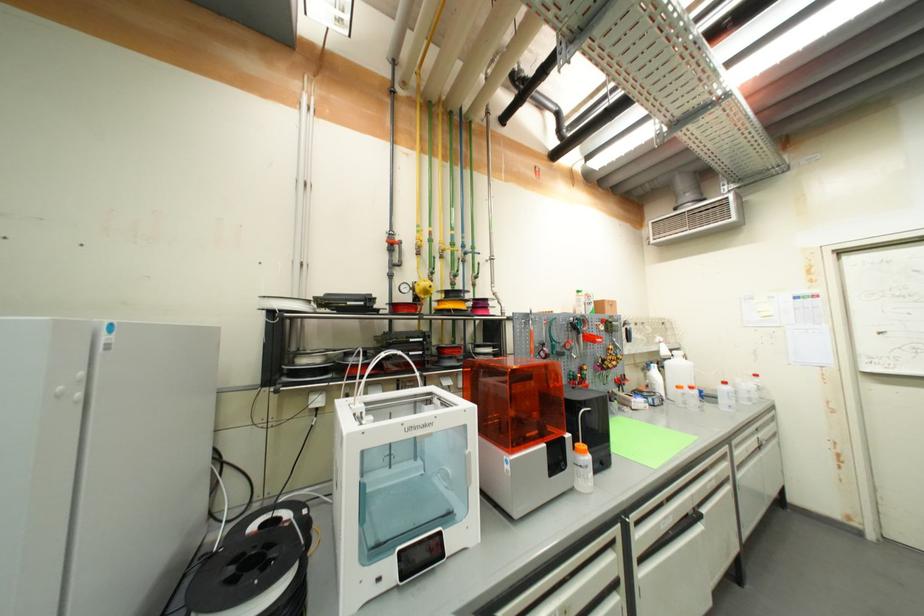
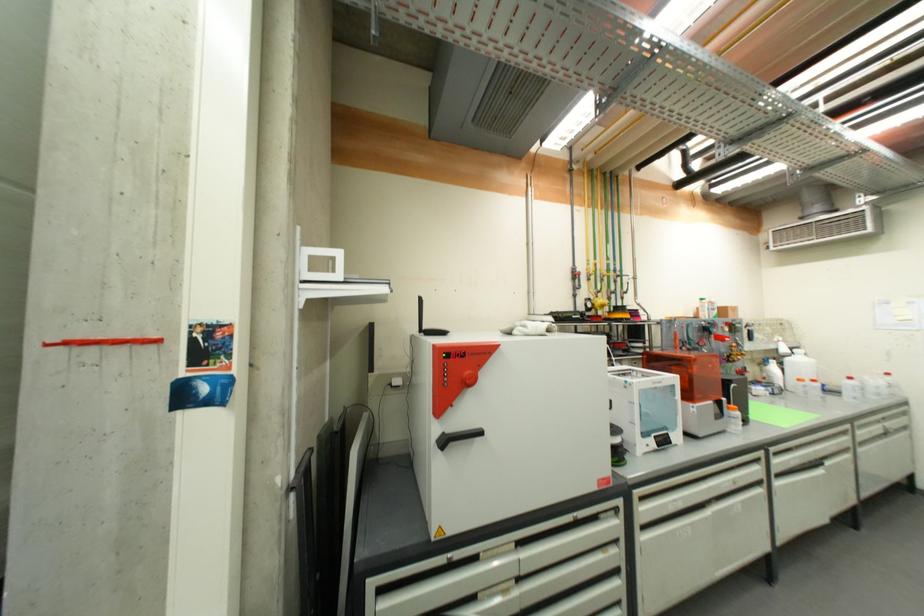
The point at (x=641, y=556) is marked in the first image. Where is the corresponding point in the second image?

(779, 472)